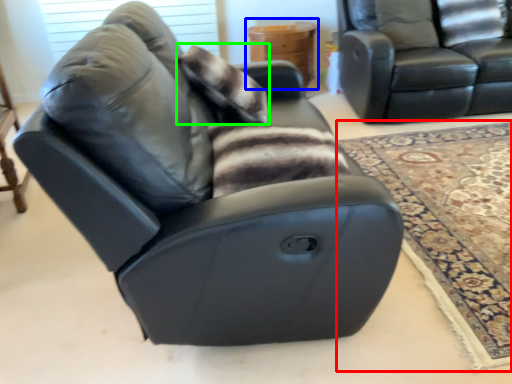
Question: Which is farther away from mat (highlighted by a red box)? table (highlighted by a blue box) or pillow (highlighted by a green box)?

Choices:
 (A) table
 (B) pillow

Answer: (A)